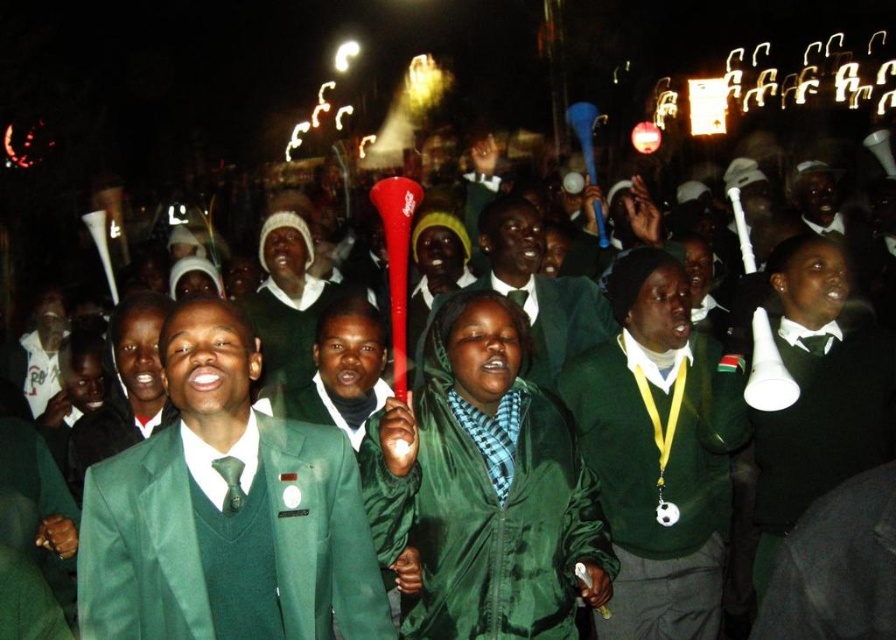
Question: Among these objects, which one is nearest to the camera?

Choices:
 (A) green fabric megaphone at center
 (B) green fabric suit at center

Answer: (B)

Question: Does green fabric suit at center appear on the right side of green fabric megaphone at center?

Choices:
 (A) no
 (B) yes

Answer: (A)

Question: Based on their relative distances, which object is nearer to the green fabric megaphone at center?

Choices:
 (A) green wool sweater at center
 (B) green fabric jacket at center
 (C) green fabric suit at center

Answer: (B)

Question: Does green fabric suit at center appear under green fabric jacket at center?

Choices:
 (A) yes
 (B) no

Answer: (A)

Question: Can you confirm if green fabric suit at center is positioned to the right of green fabric megaphone at center?

Choices:
 (A) yes
 (B) no

Answer: (B)

Question: Which is farther from the green fabric jacket at center?

Choices:
 (A) green fabric suit at center
 (B) green wool sweater at center

Answer: (A)